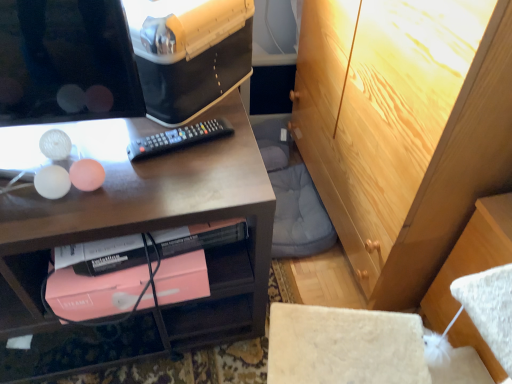
Find the location of a particular element. The image size is (512, 384). light brown wood cabinet at upper right is located at coordinates (404, 129).

Would you say light brown wood cabinet at upper right is to the left or to the right of black plastic remote at center in the picture?

Based on their positions, light brown wood cabinet at upper right is located to the right of black plastic remote at center.

Is light brown wood cabinet at upper right bigger than black plastic remote at center?

Yes.

Considering the sizes of objects light brown wood cabinet at upper right and black plastic remote at center in the image provided, who is wider, light brown wood cabinet at upper right or black plastic remote at center?

With larger width is light brown wood cabinet at upper right.

From a real-world perspective, is light brown wood cabinet at upper right above or below black plastic remote at center?

Clearly, from a real-world perspective, light brown wood cabinet at upper right is below black plastic remote at center.

Looking at this image, based on their sizes in the image, would you say pink matte book at lower center is bigger or smaller than light brown wood cabinet at upper right?

Clearly, pink matte book at lower center is smaller in size than light brown wood cabinet at upper right.

Is pink matte book at lower center not within light brown wood cabinet at upper right?

Yes, pink matte book at lower center is not within light brown wood cabinet at upper right.

In the image, is pink matte book at lower center on the left side or the right side of light brown wood cabinet at upper right?

In the image, pink matte book at lower center appears on the left side of light brown wood cabinet at upper right.

The height and width of the screenshot is (384, 512). What are the coordinates of `book behind the light brown wood cabinet at upper right` in the screenshot? It's located at (94, 293).

From the image's perspective, is matte wood desk at upper left located beneath pink matte book at lower center?

No.

Which of these two, matte wood desk at upper left or pink matte book at lower center, is thinner?

pink matte book at lower center is thinner.

Can you confirm if matte wood desk at upper left is shorter than pink matte book at lower center?

In fact, matte wood desk at upper left may be taller than pink matte book at lower center.

Which object is more forward, matte wood desk at upper left or pink matte book at lower center?

matte wood desk at upper left is in front.

From the picture: Which is in front, black plastic remote at center or light brown wood cabinet at upper right?

light brown wood cabinet at upper right is closer to the camera.

From the image's perspective, which object appears higher, black plastic remote at center or light brown wood cabinet at upper right?

light brown wood cabinet at upper right.

Can you confirm if black plastic remote at center is bigger than light brown wood cabinet at upper right?

No, black plastic remote at center is not bigger than light brown wood cabinet at upper right.

From the image's perspective, which object appears higher, pink matte book at lower center or black plastic remote at center?

black plastic remote at center.

Consider the image. In the image, is pink matte book at lower center positioned in front of or behind black plastic remote at center?

In the image, pink matte book at lower center appears in front of black plastic remote at center.

Between pink matte book at lower center and black plastic remote at center, which one has more height?

pink matte book at lower center.

How different are the orientations of pink matte book at lower center and black plastic remote at center in degrees?

The facing directions of pink matte book at lower center and black plastic remote at center are 10.7 degrees apart.

Is black plastic remote at center at the right side of pink matte book at lower center?

Correct, you'll find black plastic remote at center to the right of pink matte book at lower center.

From a real-world perspective, who is located higher, black plastic remote at center or pink matte book at lower center?

From a 3D spatial view, black plastic remote at center is above.

Does black plastic remote at center have a lesser width compared to pink matte book at lower center?

Indeed, black plastic remote at center has a lesser width compared to pink matte book at lower center.

Is light brown wood cabinet at upper right to the right of matte wood desk at upper left from the viewer's perspective?

Yes, light brown wood cabinet at upper right is to the right of matte wood desk at upper left.

In the image, is light brown wood cabinet at upper right positioned in front of or behind matte wood desk at upper left?

light brown wood cabinet at upper right is behind matte wood desk at upper left.

From the picture: Which of these two, light brown wood cabinet at upper right or matte wood desk at upper left, stands shorter?

Standing shorter between the two is matte wood desk at upper left.

Where is `cabinetry above the black plastic remote at center (from the image's perspective)`? The width and height of the screenshot is (512, 384). cabinetry above the black plastic remote at center (from the image's perspective) is located at coordinates (404, 129).

Locate an element on the screen. The height and width of the screenshot is (384, 512). book below the light brown wood cabinet at upper right (from the image's perspective) is located at coordinates (94, 293).

When comparing their distances from light brown wood cabinet at upper right, does black plastic remote at center or matte wood desk at upper left seem further?

black plastic remote at center is positioned further to the anchor light brown wood cabinet at upper right.

From the image, which object appears to be nearer to matte wood desk at upper left, black plastic remote at center or light brown wood cabinet at upper right?

black plastic remote at center.

Consider the image. When comparing their distances from light brown wood cabinet at upper right, does pink matte book at lower center or black plastic remote at center seem further?

The object further to light brown wood cabinet at upper right is pink matte book at lower center.

Based on their spatial positions, is matte wood desk at upper left or light brown wood cabinet at upper right further from black plastic remote at center?

light brown wood cabinet at upper right is further to black plastic remote at center.

Looking at the image, which one is located closer to light brown wood cabinet at upper right, pink matte book at lower center or matte wood desk at upper left?

Based on the image, matte wood desk at upper left appears to be nearer to light brown wood cabinet at upper right.

Based on their spatial positions, is light brown wood cabinet at upper right or black plastic remote at center further from pink matte book at lower center?

light brown wood cabinet at upper right is further to pink matte book at lower center.

When comparing their distances from light brown wood cabinet at upper right, does matte wood desk at upper left or pink matte book at lower center seem closer?

matte wood desk at upper left is positioned closer to the anchor light brown wood cabinet at upper right.

When comparing their distances from black plastic remote at center, does pink matte book at lower center or matte wood desk at upper left seem further?

matte wood desk at upper left is positioned further to the anchor black plastic remote at center.

Where is `book situated between matte wood desk at upper left and light brown wood cabinet at upper right from left to right`? book situated between matte wood desk at upper left and light brown wood cabinet at upper right from left to right is located at coordinates (x=94, y=293).

Image resolution: width=512 pixels, height=384 pixels. I want to click on remote control situated between matte wood desk at upper left and light brown wood cabinet at upper right from left to right, so click(178, 139).

Image resolution: width=512 pixels, height=384 pixels. In order to click on remote control between pink matte book at lower center and light brown wood cabinet at upper right in this screenshot , I will do `click(178, 139)`.

Identify the location of desk that lies between black plastic remote at center and pink matte book at lower center from top to bottom. (139, 231).